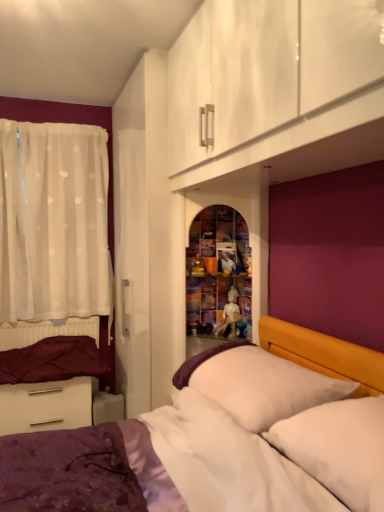
Question: From a real-world perspective, is purple velvet bed at lower left positioned above or below white sheer curtain at left?

Choices:
 (A) above
 (B) below

Answer: (B)

Question: Is purple velvet bed at lower left spatially inside white sheer curtain at left, or outside of it?

Choices:
 (A) outside
 (B) inside

Answer: (A)

Question: Which is farther from the white glossy drawer at lower left?

Choices:
 (A) purple velvet bed at lower left
 (B) matte white bed frame at lower left
 (C) white soft pillow at right, placed as the 2th pillow when sorted from back to front
 (D) white sheer curtain at left
 (E) white soft pillow at center, the 1th pillow from the back

Answer: (C)

Question: Which is nearer to the purple velvet bed at lower left?

Choices:
 (A) white soft pillow at right, placed as the 2th pillow when sorted from back to front
 (B) white soft pillow at center, acting as the second pillow starting from the front
 (C) white glossy drawer at lower left
 (D) white sheer curtain at left
 (E) matte white bed frame at lower left

Answer: (B)